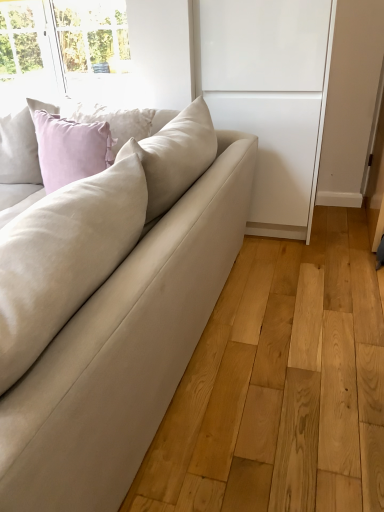
Question: Considering the relative sizes of white matte cabinet at center and beige fabric couch at center in the image provided, is white matte cabinet at center smaller than beige fabric couch at center?

Choices:
 (A) yes
 (B) no

Answer: (A)

Question: From the image's perspective, is white matte cabinet at center on beige fabric couch at center?

Choices:
 (A) no
 (B) yes

Answer: (B)

Question: Would you say white matte cabinet at center is a long distance from beige fabric couch at center?

Choices:
 (A) yes
 (B) no

Answer: (B)

Question: Is white matte cabinet at center facing towards beige fabric couch at center?

Choices:
 (A) yes
 (B) no

Answer: (A)

Question: Does white matte cabinet at center have a greater width compared to beige fabric couch at center?

Choices:
 (A) yes
 (B) no

Answer: (B)

Question: Is white matte cabinet at center to the right of beige fabric couch at center from the viewer's perspective?

Choices:
 (A) no
 (B) yes

Answer: (B)

Question: From a real-world perspective, is beige fabric couch at center under white matte cabinet at center?

Choices:
 (A) yes
 (B) no

Answer: (A)

Question: Does beige fabric couch at center have a greater height compared to white matte cabinet at center?

Choices:
 (A) no
 (B) yes

Answer: (A)

Question: Is beige fabric couch at center outside white matte cabinet at center?

Choices:
 (A) yes
 (B) no

Answer: (A)

Question: Is beige fabric couch at center turned away from white matte cabinet at center?

Choices:
 (A) yes
 (B) no

Answer: (A)

Question: Considering the relative sizes of beige fabric couch at center and white matte cabinet at center in the image provided, is beige fabric couch at center smaller than white matte cabinet at center?

Choices:
 (A) no
 (B) yes

Answer: (A)

Question: Could you tell me if beige fabric couch at center is facing white matte cabinet at center?

Choices:
 (A) no
 (B) yes

Answer: (A)

Question: Considering their positions, is white matte cabinet at center located in front of or behind beige fabric couch at center?

Choices:
 (A) front
 (B) behind

Answer: (B)